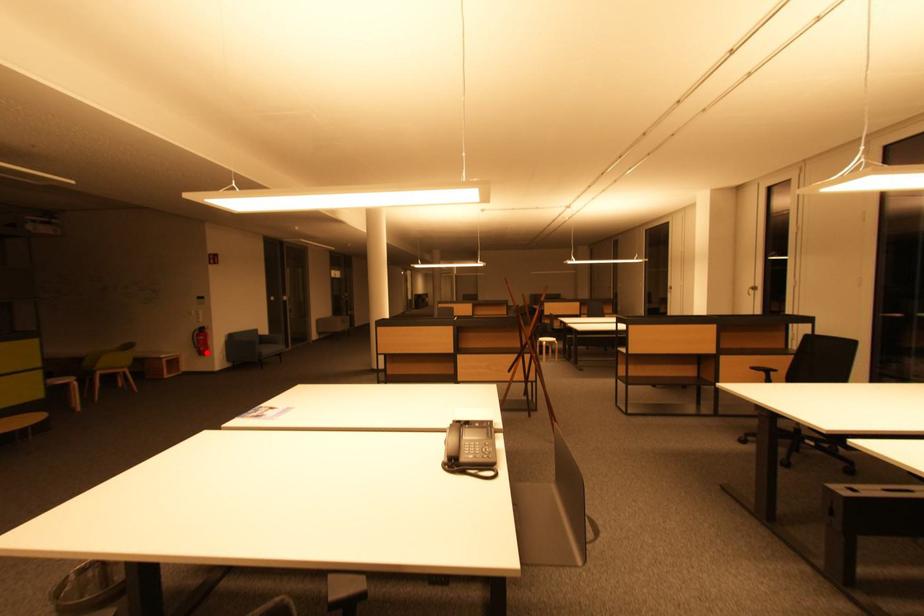
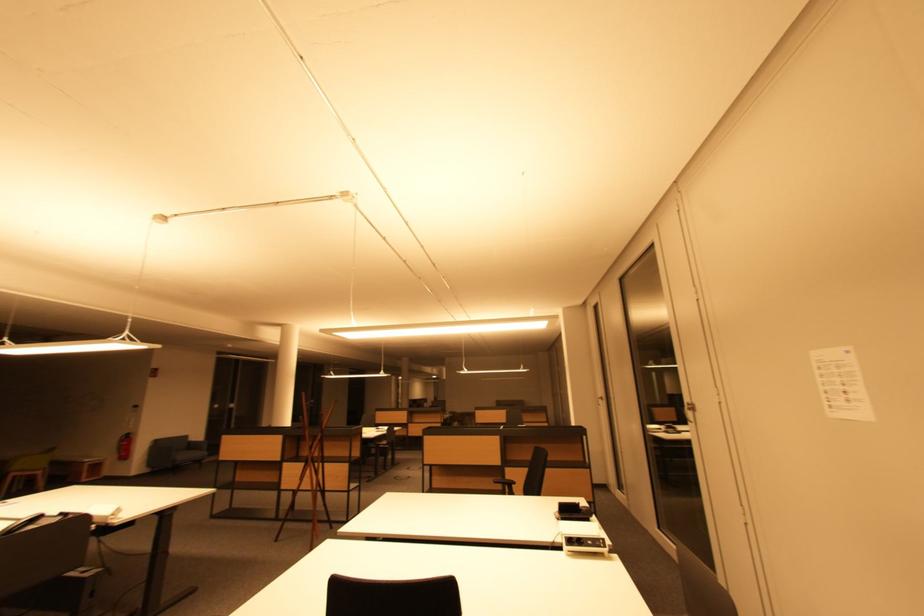
Question: I am providing you with two images of the same scene from different viewpoints. Given a red point in image1, look at the same physical point in image2. Is it:

Choices:
 (A) Closer to the viewpoint
 (B) Farther from the viewpoint

Answer: (A)